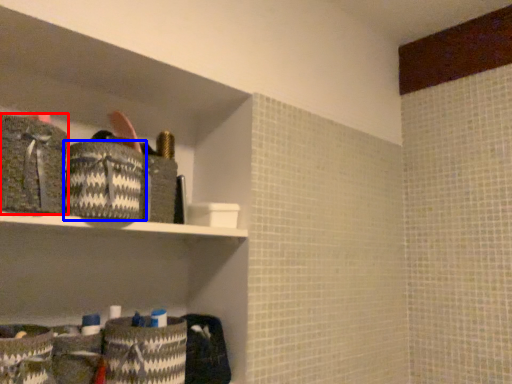
Question: Among these objects, which one is nearest to the camera, material (highlighted by a red box) or material (highlighted by a blue box)?

Choices:
 (A) material
 (B) material

Answer: (A)